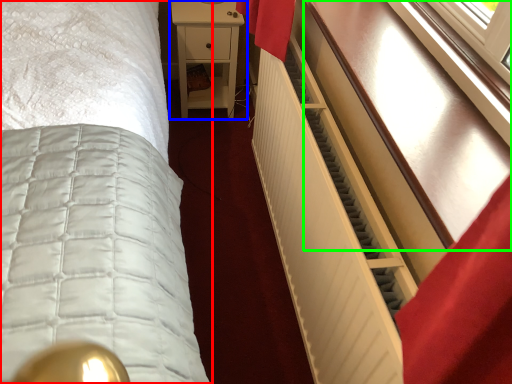
Question: Which object is positioned farthest from bed (highlighted by a red box)? Select from nightstand (highlighted by a blue box) and vanity (highlighted by a green box).

Choices:
 (A) nightstand
 (B) vanity

Answer: (A)